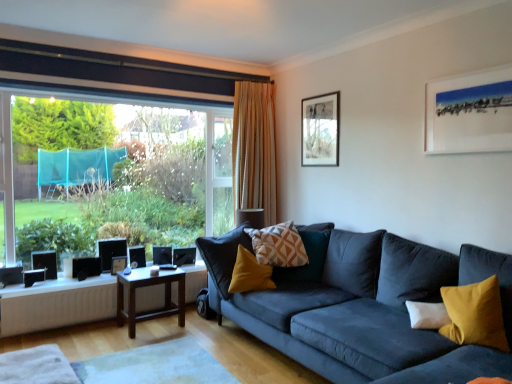
Find the location of a particular element. vacant space situated above white soft pillow at lower right, acting as the first pillow starting from the bottom (from a real-world perspective) is located at coordinates (432, 301).